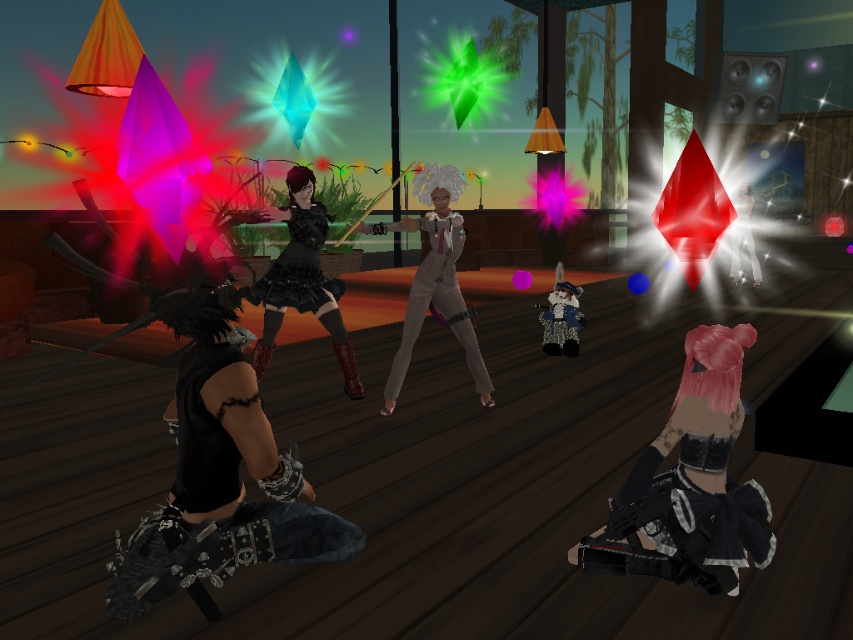
You are standing at the center of the wooden deck in the image. There is a point marked at coordinates (436, 280). What object is located at that point?

The satin beige suit at center is located at point (436, 280).

Based on the photo, you are a character in the game and need to grab the black leather jacket at lower right. If your arm can reach up to 8 feet, can you reach it?

The black leather jacket at lower right is 9.12 feet away from the camera, which is beyond your arm reach of 8 feet. You cannot reach it.